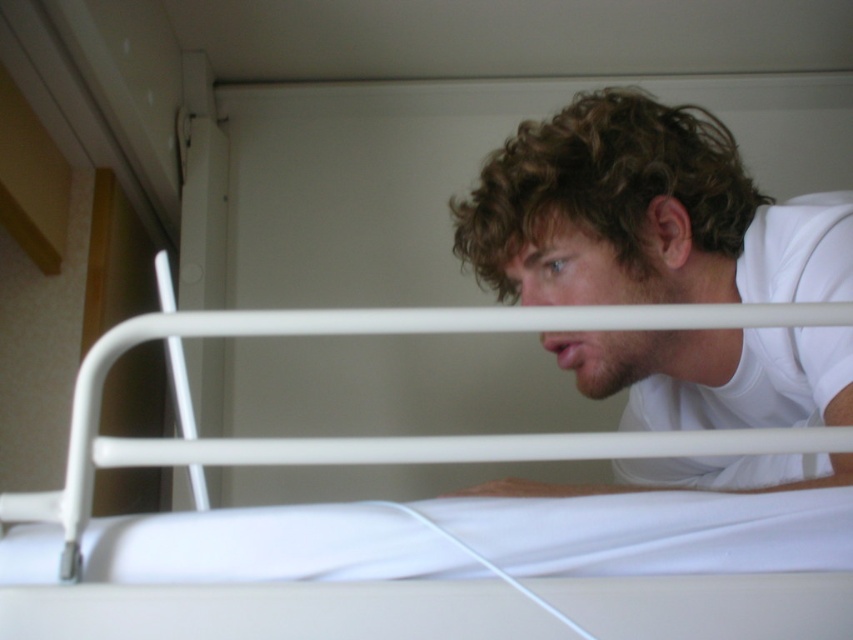
In the scene shown: You are standing in the room and want to take a photo of the person lying on the bed. The camera you are using has a minimum focus distance of 3 feet. Will the point at point (x=500, y=173) be in focus?

The point at point (x=500, y=173) is 3.47 feet away from the camera, which is beyond the minimum focus distance of 3 feet. Therefore, the point will be in focus.

You are a photographer setting up a shoot in this room. You have a camera that can only focus on objects within a 1.5 meter height range. The white matte shirt at upper right and the white metal bunk bed at center are both in your frame. Which object will be in focus if you set the focus point to the midpoint between their heights?

The white matte shirt at upper right is much taller than the white metal bunk bed at center. The midpoint between their heights would still be closer to the shirt, so the camera would focus on the white matte shirt at upper right.